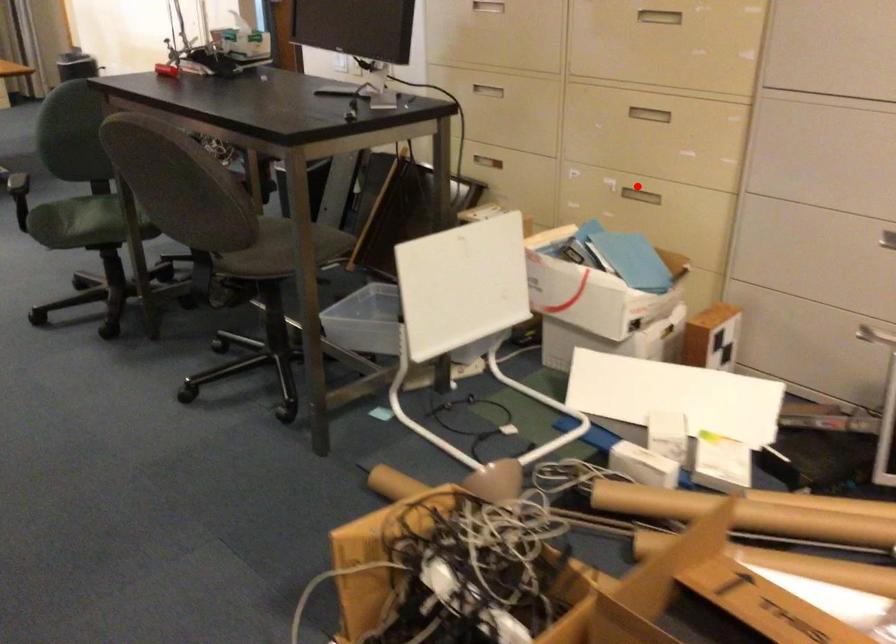
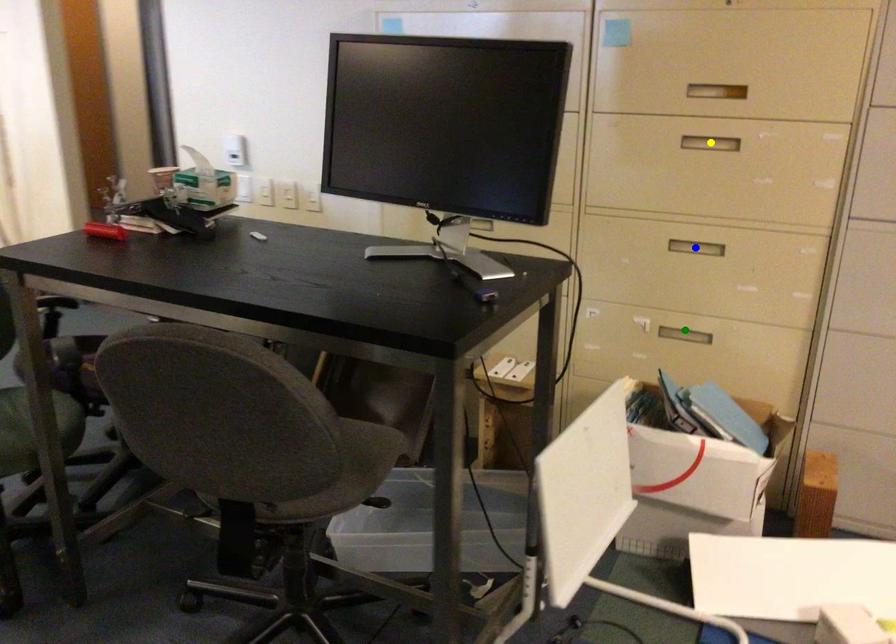
Question: I am providing you with two images of the same scene from different viewpoints. A red point is marked on the first image. You are given multiple points on the second image. Which point in image 2 represents the same 3d spot as the red point in image 1?

Choices:
 (A) green point
 (B) blue point
 (C) yellow point

Answer: (A)